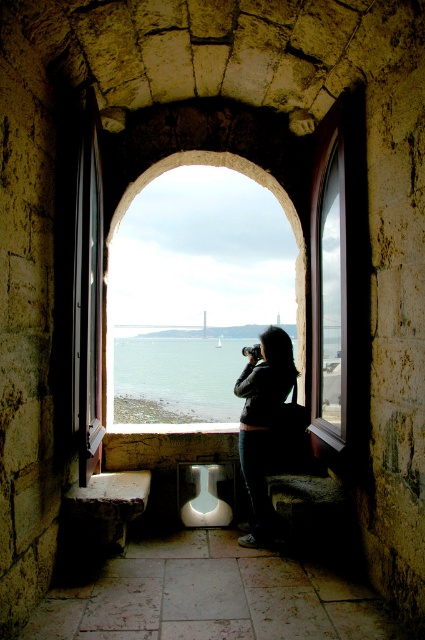
You are standing in a historical building and want to see the view through the transparent glass window at center. However, you are wearing the dark gray sweater at center. Could the sweater block your view of the window?

The transparent glass window at center might be wider than dark gray sweater at center, so there is a possibility that the sweater will not fully block your view of the window.

You are standing in a historical building and looking through the transparent glass window at center. You notice a dark gray sweater at center on the floor below. Can you reach the sweater without stepping away from the window?

The transparent glass window at center is located above the dark gray sweater at center, so you can reach down to pick up the sweater from the window area without moving away from the window.

You are a painter standing in front of the transparent glass window at center and the dark gray sweater at center. You want to paint both objects on a canvas. Since you can only focus on one object at a time, which object should you paint first to ensure the other remains in your field of view without moving your head?

You should paint the dark gray sweater at center first because it is closer to you than the transparent glass window at center. By starting with the closer object, you can maintain the distant transparent glass window at center in your field of view without needing to adjust your head position.